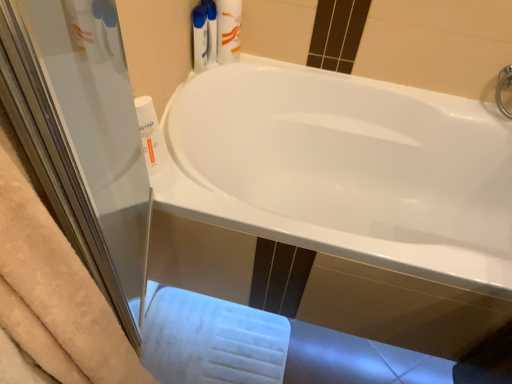
Where is `vacant area that lies in front of white plastic bottle at upper center, the 2th cleaning product positioned from the front`? Image resolution: width=512 pixels, height=384 pixels. vacant area that lies in front of white plastic bottle at upper center, the 2th cleaning product positioned from the front is located at coordinates (203, 83).